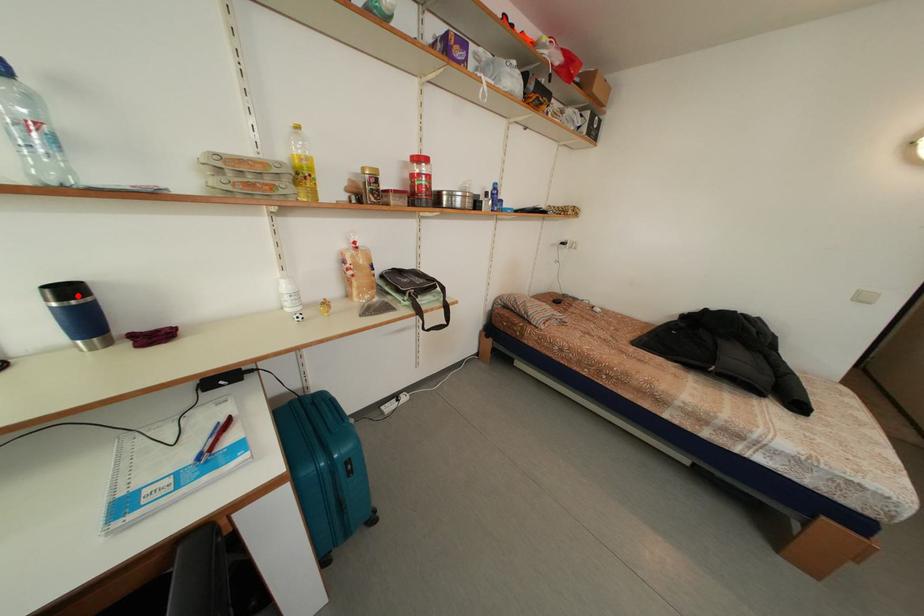
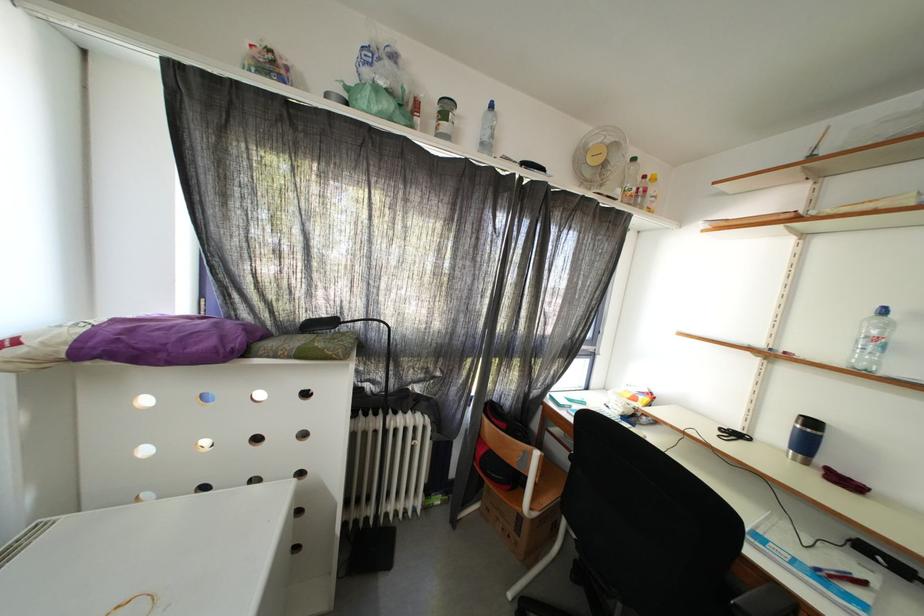
Question: I am providing you with two images of the same scene from different viewpoints. A red point is marked on the first image. Is the red point's position out of view in image 2?

Choices:
 (A) Yes
 (B) No

Answer: (B)